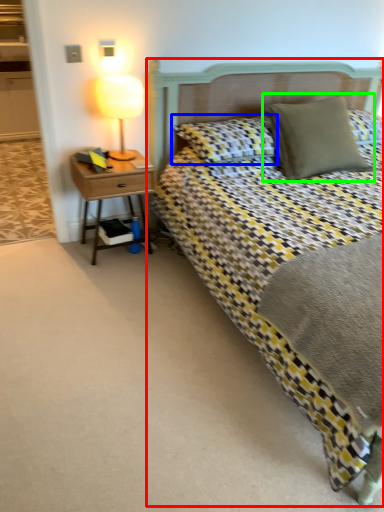
Question: Which object is positioned farthest from bed (highlighted by a red box)? Select from pillow (highlighted by a blue box) and pillow (highlighted by a green box).

Choices:
 (A) pillow
 (B) pillow

Answer: (B)